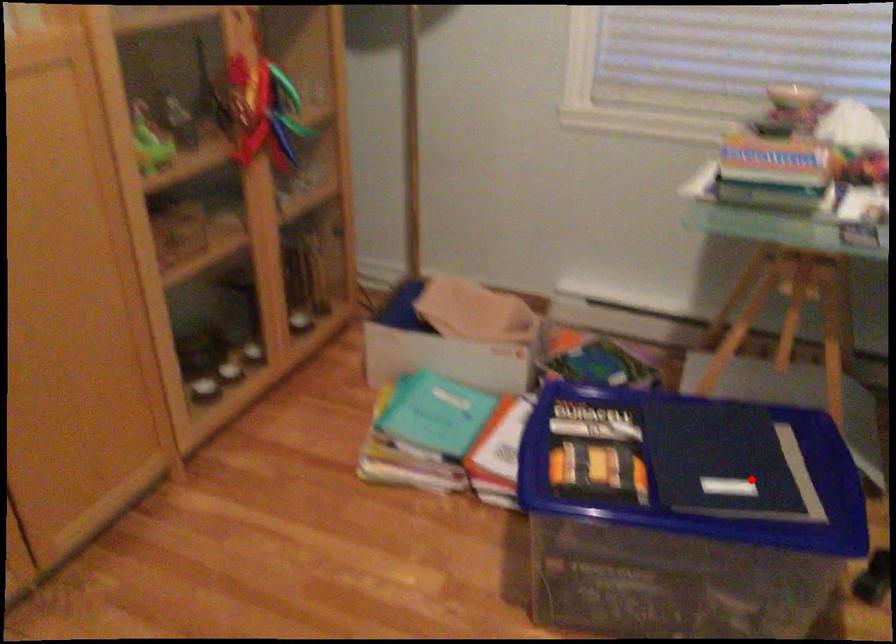
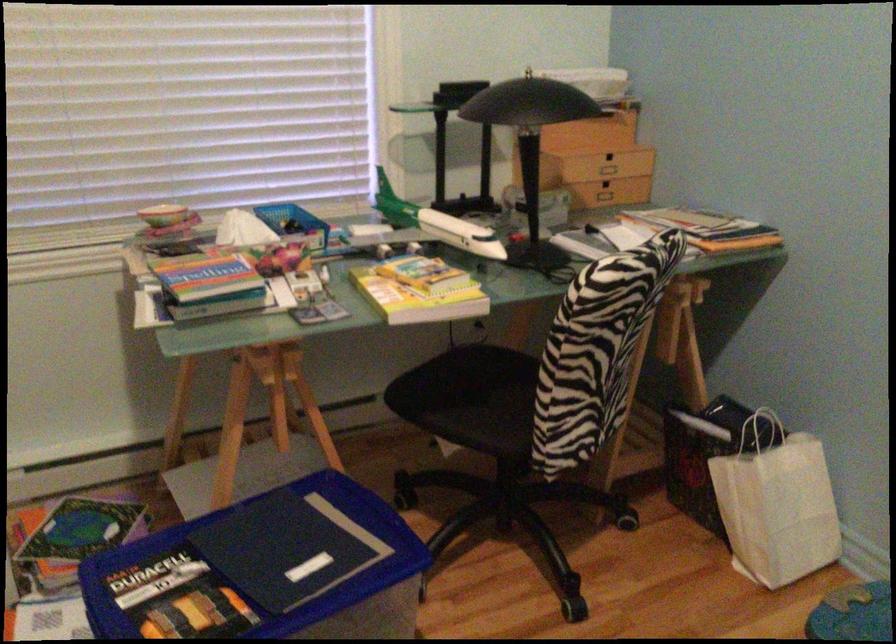
In the second image, find the point that corresponds to the highlighted location in the first image.

(316, 551)